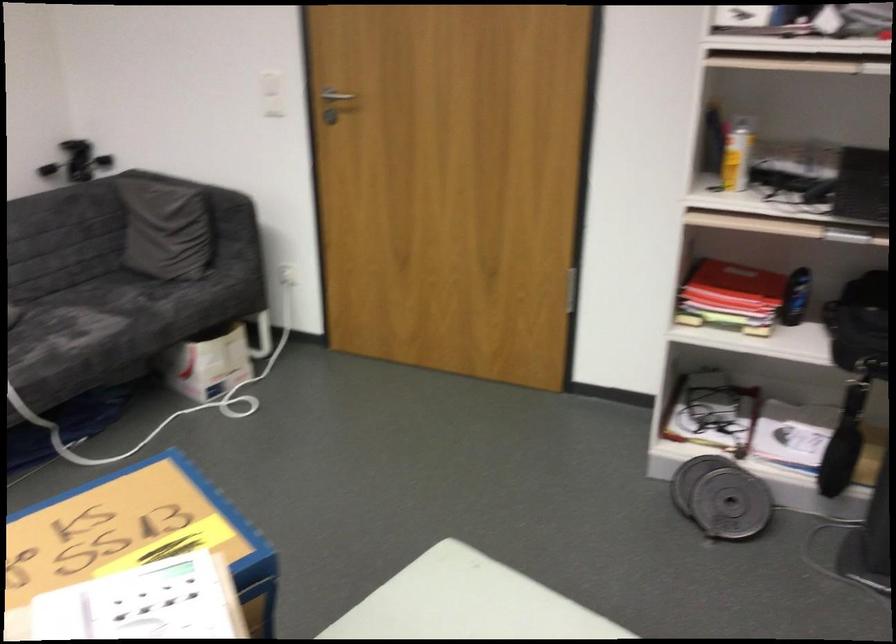
The location [736,158] corresponds to which object?

It refers to a yellow spray can.